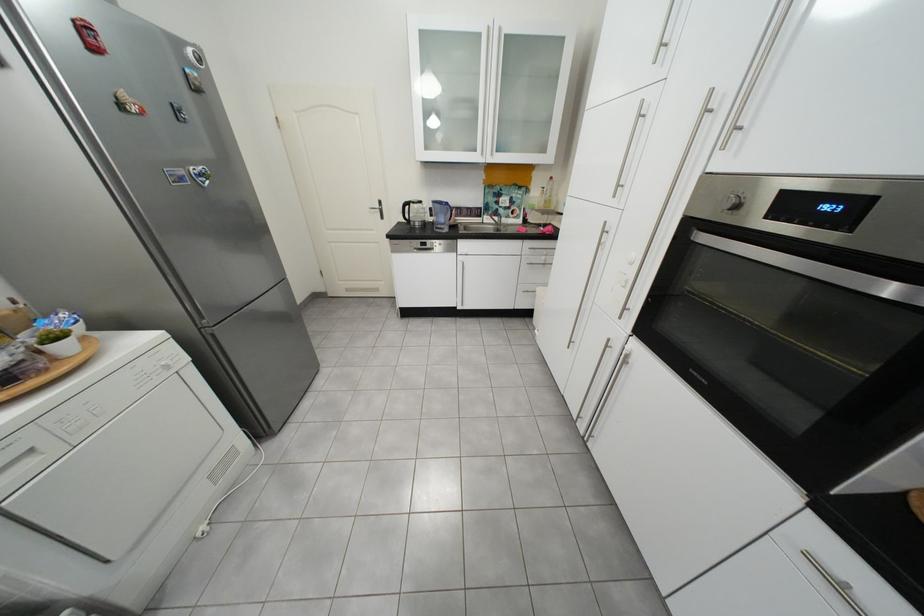
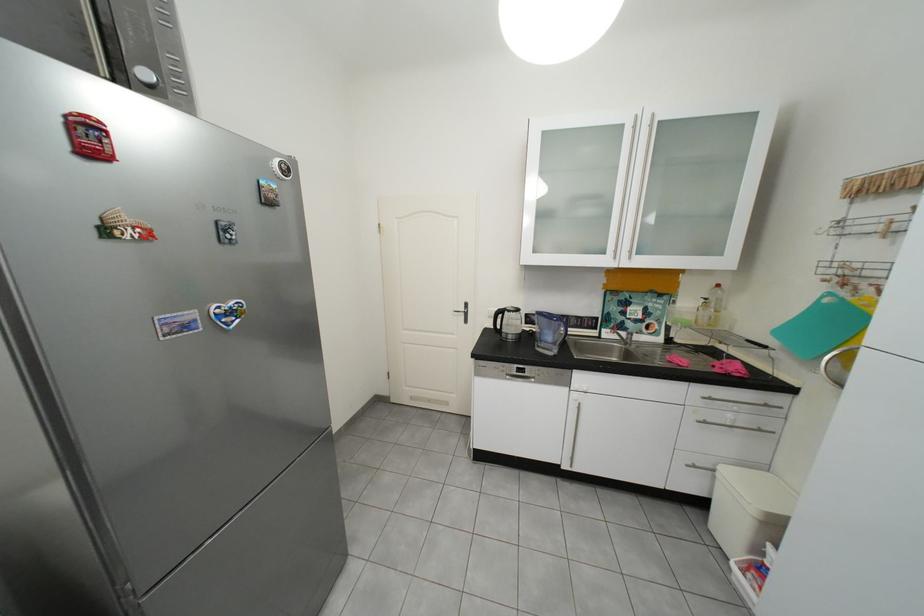
Locate, in the second image, the point that corresponds to the point at 544,249 in the first image.

(723, 400)